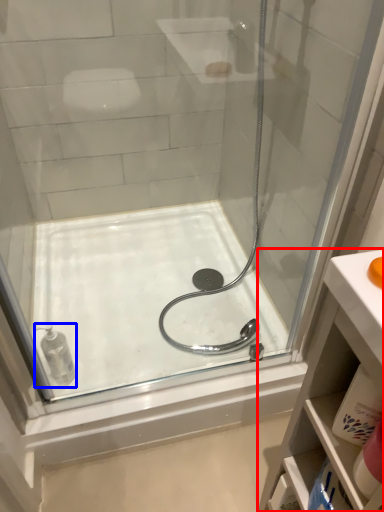
Question: Which point is further to the camera, bathroom cabinet (highlighted by a red box) or toiletry (highlighted by a blue box)?

Choices:
 (A) bathroom cabinet
 (B) toiletry

Answer: (B)